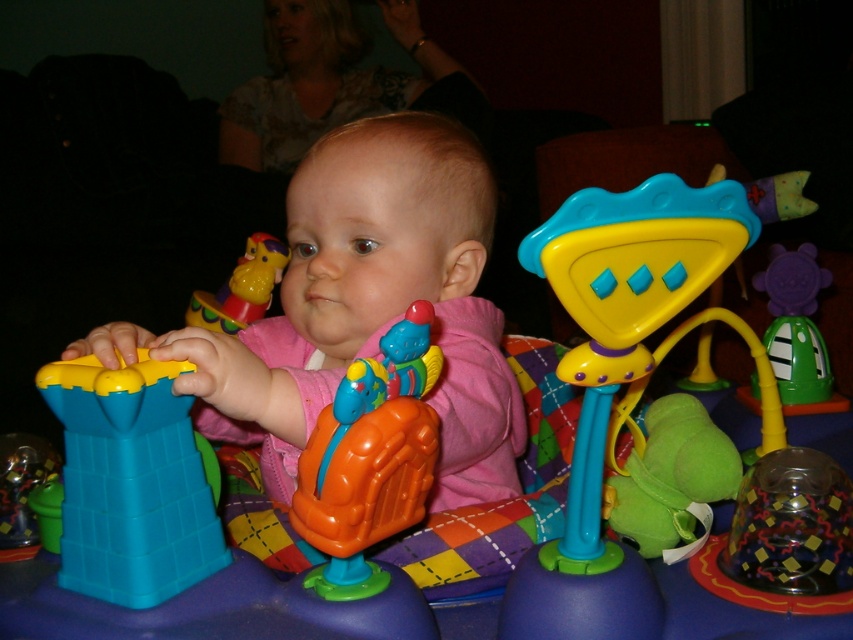
Question: Is blue plastic tower at left above green rubber turtle at right?

Choices:
 (A) yes
 (B) no

Answer: (B)

Question: From the image, what is the correct spatial relationship of orange plastic toy at center in relation to green rubber turtle at right?

Choices:
 (A) above
 (B) below

Answer: (B)

Question: Which point is farther from the camera taking this photo?

Choices:
 (A) pos(258,289)
 (B) pos(456,500)
 (C) pos(181,582)

Answer: (A)

Question: Among these points, which one is nearest to the camera?

Choices:
 (A) (370, 323)
 (B) (154, 492)
 (C) (811, 378)
 (D) (194, 317)

Answer: (B)

Question: Does pink matte baby at center appear on the left side of green rubber turtle at right?

Choices:
 (A) yes
 (B) no

Answer: (A)

Question: Based on their relative distances, which object is nearer to the orange plastic toy at center?

Choices:
 (A) green rubber turtle at right
 (B) matte plastic toy at upper left
 (C) pink matte baby at center

Answer: (C)